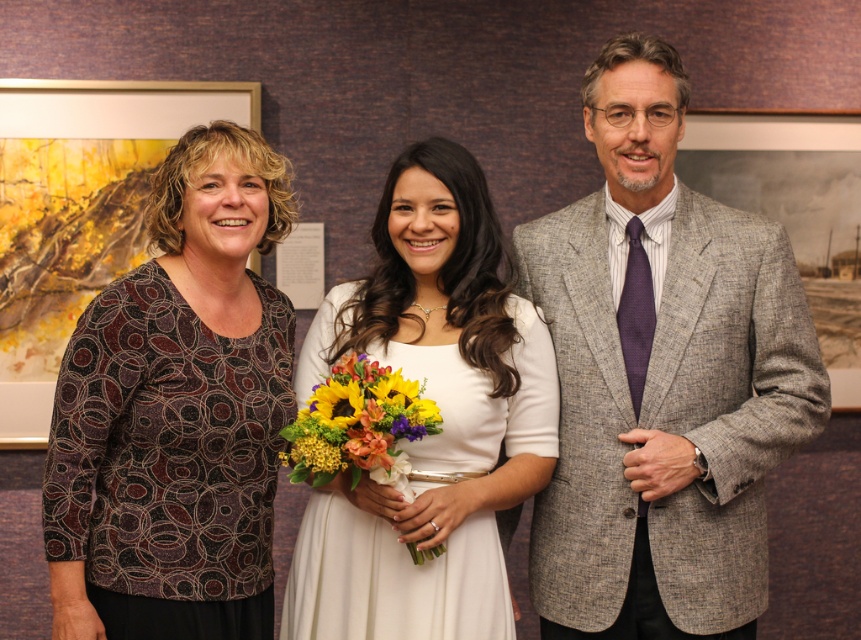
Question: Can you confirm if white satin dress at center is smaller than vibrant floral bouquet at center?

Choices:
 (A) yes
 (B) no

Answer: (B)

Question: Which object is positioned farthest from the vibrant floral bouquet at center?

Choices:
 (A) sunflower bouquet at center
 (B) patterned fabric blouse at left

Answer: (B)

Question: Considering the relative positions of patterned fabric blouse at left and vibrant floral bouquet at center in the image provided, where is patterned fabric blouse at left located with respect to vibrant floral bouquet at center?

Choices:
 (A) right
 (B) left

Answer: (B)

Question: Is gray wool suit at right bigger than patterned fabric blouse at left?

Choices:
 (A) yes
 (B) no

Answer: (A)

Question: Estimate the real-world distances between objects in this image. Which object is closer to the sunflower bouquet at center?

Choices:
 (A) gray wool suit at right
 (B) vibrant floral bouquet at center

Answer: (B)

Question: Among these objects, which one is farthest from the camera?

Choices:
 (A) vibrant floral bouquet at center
 (B) patterned fabric blouse at left

Answer: (B)